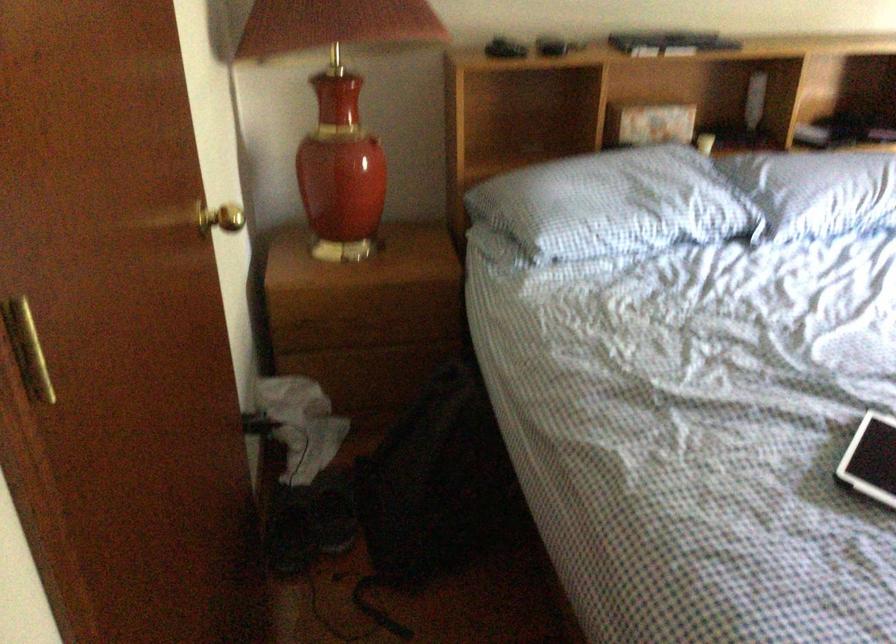
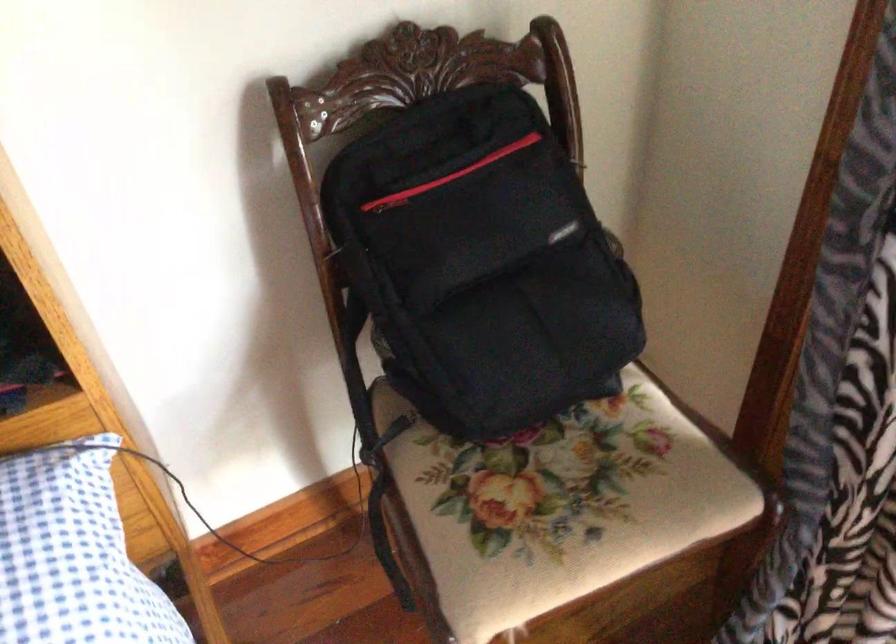
In a continuous first-person perspective shot, in which direction is the camera moving?

The cameraman moved toward right, forward.